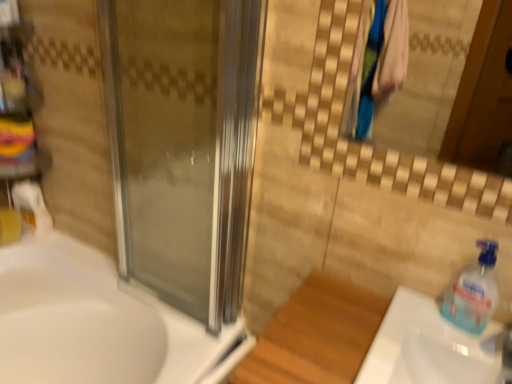
Question: Is transparent plastic soap dispenser at right facing towards white glossy sink at lower right, which is counted as the 2th sink, starting from the left?

Choices:
 (A) yes
 (B) no

Answer: (B)

Question: Considering the relative sizes of transparent plastic soap dispenser at right and white glossy sink at lower right, the 1th sink in the right-to-left sequence, in the image provided, is transparent plastic soap dispenser at right thinner than white glossy sink at lower right, the 1th sink in the right-to-left sequence,?

Choices:
 (A) no
 (B) yes

Answer: (B)

Question: Considering the relative sizes of transparent plastic soap dispenser at right and white glossy sink at lower right, the first sink viewed from the front, in the image provided, is transparent plastic soap dispenser at right shorter than white glossy sink at lower right, the first sink viewed from the front,?

Choices:
 (A) no
 (B) yes

Answer: (A)

Question: From a real-world perspective, is transparent plastic soap dispenser at right positioned over white glossy sink at lower right, the 1th sink in the right-to-left sequence, based on gravity?

Choices:
 (A) yes
 (B) no

Answer: (A)

Question: From a real-world perspective, does transparent plastic soap dispenser at right sit lower than white glossy sink at lower right, which is counted as the 2th sink, starting from the left?

Choices:
 (A) no
 (B) yes

Answer: (A)

Question: Are transparent plastic soap dispenser at right and white glossy sink at lower right, the first sink viewed from the front, located far from each other?

Choices:
 (A) no
 (B) yes

Answer: (A)

Question: Is transparent glass screen door at center wider than white glossy sink at lower left, arranged as the 2th sink when viewed from the right?

Choices:
 (A) yes
 (B) no

Answer: (B)

Question: Could you tell me if transparent glass screen door at center is turned towards white glossy sink at lower left, marked as the 1th sink in a back-to-front arrangement?

Choices:
 (A) no
 (B) yes

Answer: (A)

Question: Does transparent glass screen door at center come behind white glossy sink at lower left, the 1th sink in the left-to-right sequence?

Choices:
 (A) no
 (B) yes

Answer: (A)

Question: Does transparent glass screen door at center lie in front of white glossy sink at lower left, which is the second sink from front to back?

Choices:
 (A) no
 (B) yes

Answer: (B)

Question: From a real-world perspective, is transparent glass screen door at center physically above white glossy sink at lower left, which is the second sink from front to back?

Choices:
 (A) no
 (B) yes

Answer: (B)

Question: From the image's perspective, is transparent glass screen door at center located beneath white glossy sink at lower left, the 1th sink in the left-to-right sequence?

Choices:
 (A) yes
 (B) no

Answer: (B)

Question: Does transparent glass screen door at center contain transparent plastic soap dispenser at right?

Choices:
 (A) yes
 (B) no

Answer: (B)